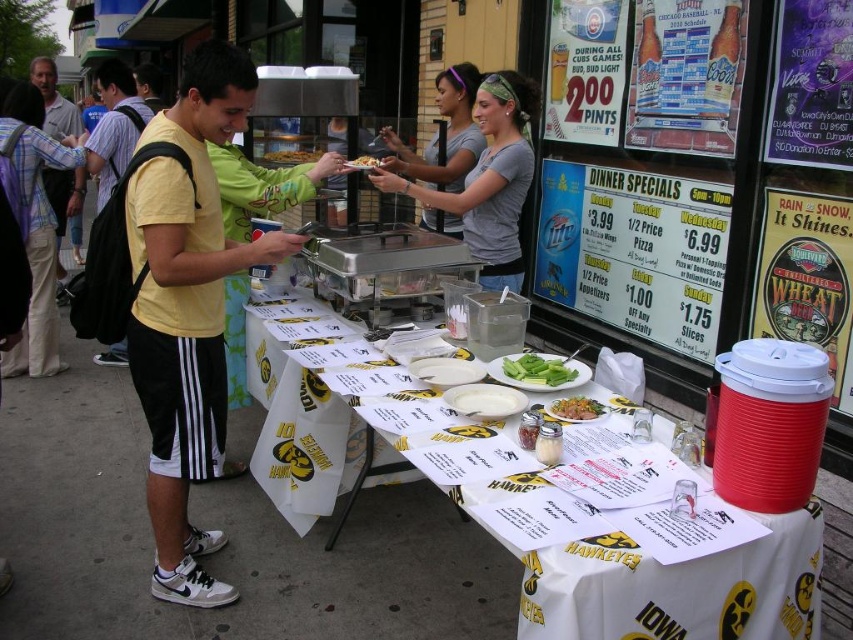
Question: Is gray cotton shirt at center positioned behind white matte plate at center?

Choices:
 (A) yes
 (B) no

Answer: (A)

Question: Among these points, which one is farthest from the camera?

Choices:
 (A) (155, 506)
 (B) (486, 385)
 (C) (119, 140)
 (D) (526, 376)

Answer: (C)

Question: Which of the following is the farthest from the observer?

Choices:
 (A) (219, 234)
 (B) (409, 188)

Answer: (B)

Question: Which point is farther to the camera?

Choices:
 (A) golden crispy fries at center
 (B) yellow matte t-shirt at left
 (C) matte gray shirt at center
 (D) light gray shirt at upper left

Answer: (D)

Question: From the image, what is the correct spatial relationship of white matte plate at center in relation to green matte cucumber at center?

Choices:
 (A) right
 (B) left

Answer: (B)

Question: Can you confirm if matte gray shirt at center is positioned above yellow matte t-shirt at left?

Choices:
 (A) no
 (B) yes

Answer: (A)